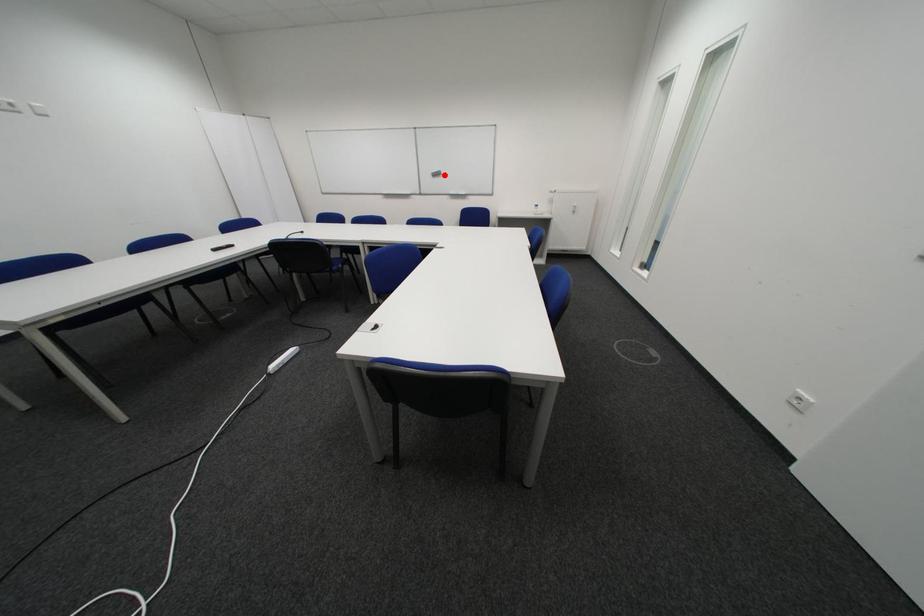
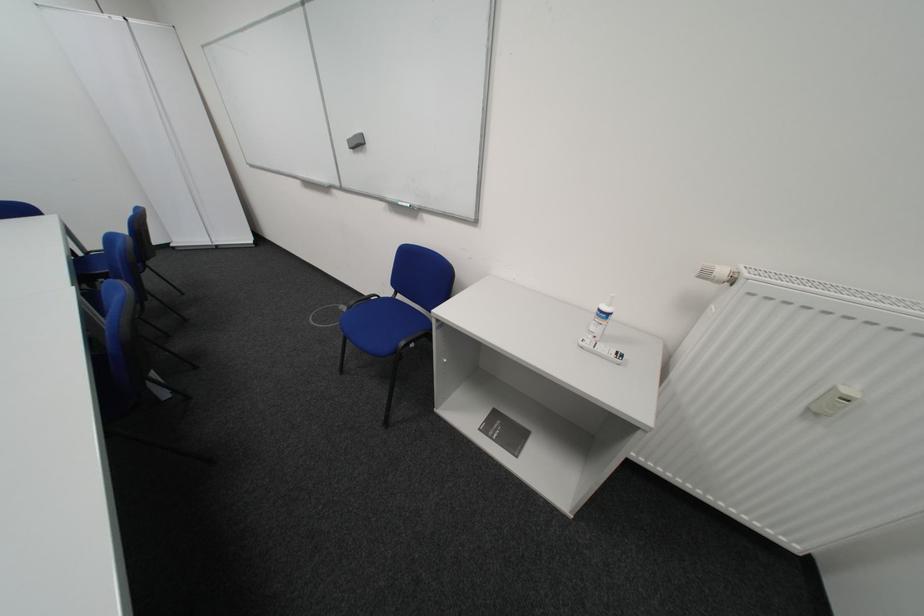
Question: I am providing you with two images of the same scene from different viewpoints. Image1 has a red point marked. In image2, the corresponding 3D location appears at what relative position? Reply with the corresponding letter.

Choices:
 (A) Closer
 (B) Farther

Answer: (B)